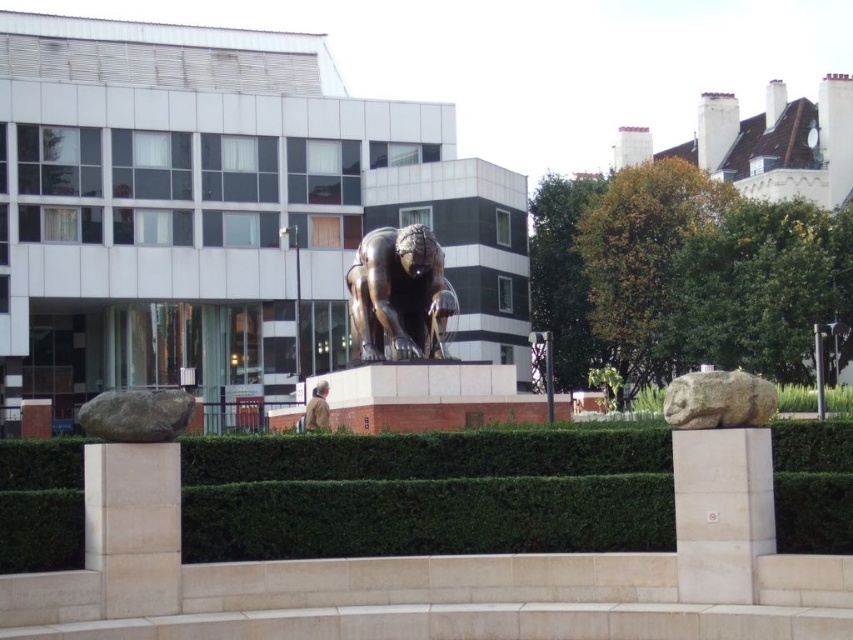
You are a maintenance worker assigned to water the green hedge at center and the bronze statue at center. Since the statue is heavy, you need to move it to access the hedge. Which object should you move first to reach the other?

You should move the bronze statue at center first because the green hedge at center is positioned under it, so moving the statue will allow access to the hedge.